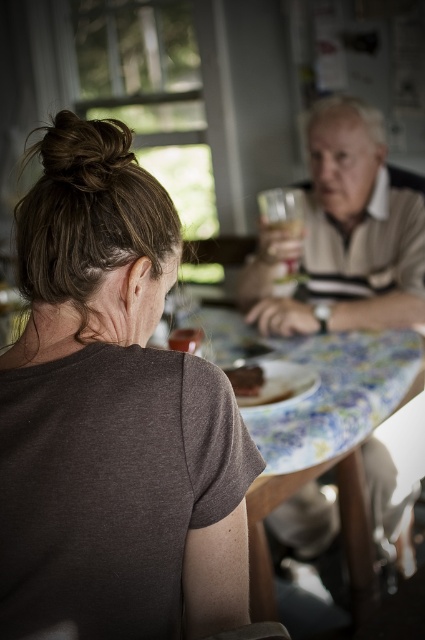
Question: Is floral-patterned table at center positioned in front of smooth brown bread at center?

Choices:
 (A) yes
 (B) no

Answer: (A)

Question: Estimate the real-world distances between objects in this image. Which object is farther from the matte beige polo shirt at upper right?

Choices:
 (A) smooth brown bread at center
 (B) dark gray t-shirt at left
 (C) floral-patterned table at center

Answer: (B)

Question: Which object is farther from the camera taking this photo?

Choices:
 (A) matte brown plate at center
 (B) matte beige polo shirt at upper right
 (C) clear glass wine glass at center

Answer: (C)

Question: Considering the relative positions of matte beige polo shirt at upper right and floral-patterned table at center in the image provided, where is matte beige polo shirt at upper right located with respect to floral-patterned table at center?

Choices:
 (A) below
 (B) above

Answer: (B)

Question: Can you confirm if floral-patterned table at center is thinner than matte brown plate at center?

Choices:
 (A) yes
 (B) no

Answer: (B)

Question: Which point is closer to the camera?

Choices:
 (A) (237, 390)
 (B) (303, 368)
 (C) (266, 221)

Answer: (A)